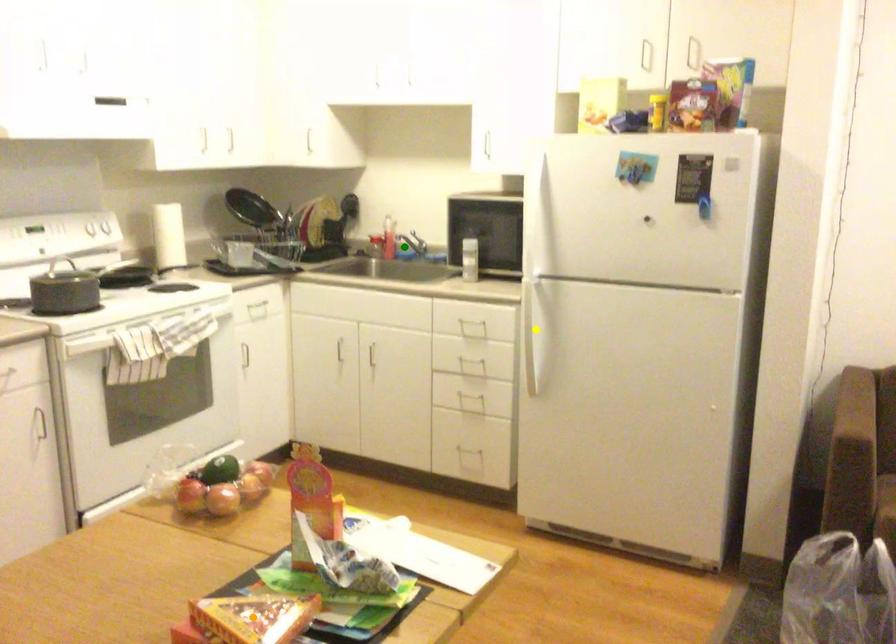
Order these from nearest to farthest:
green point, yellow point, orange point

green point
yellow point
orange point